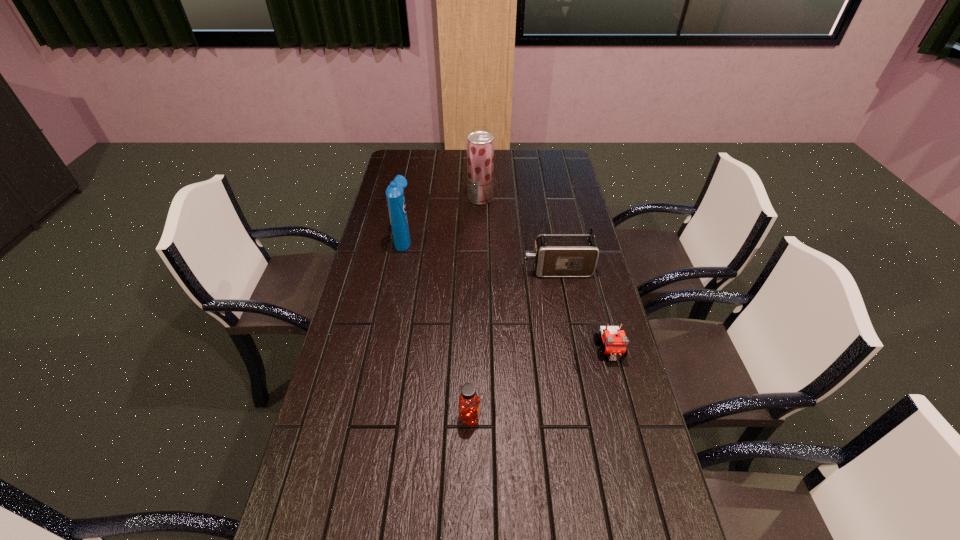
At what (x,y) coordinates should I click in order to perform the action: click on the farthest object. Please return your answer as a coordinate pair (x, y). This screenshot has width=960, height=540. Looking at the image, I should click on point(480,144).

The height and width of the screenshot is (540, 960). Identify the location of the leftmost object. coord(395,197).

Identify the location of shampoo. (395, 197).

The width and height of the screenshot is (960, 540). I want to click on camcorder, so click(x=555, y=255).

Image resolution: width=960 pixels, height=540 pixels. I want to click on the third shortest object, so click(555, 255).

Locate an element on the screen. the nearest object is located at coordinates (468, 408).

Find the location of a particular element. honey is located at coordinates (468, 408).

This screenshot has height=540, width=960. In order to click on the fourth farthest object in this screenshot , I will do `click(615, 341)`.

Identify the location of Lego. (615, 341).

The image size is (960, 540). I want to click on vacant space located on the back of the fruit juice, so click(480, 157).